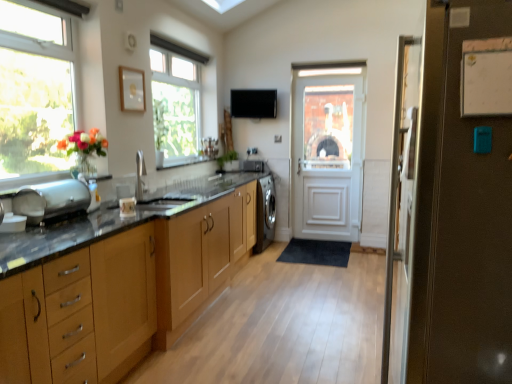
Image resolution: width=512 pixels, height=384 pixels. I want to click on blank space above satin black washing machine at center, which is counted as the 1th appliance, starting from the top (from a real-world perspective), so click(x=256, y=158).